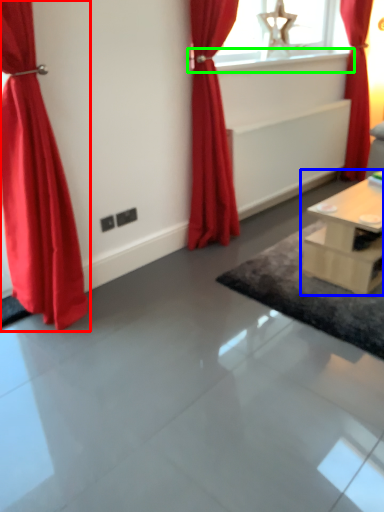
Question: Considering the real-world distances, which object is farthest from curtain (highlighted by a red box)? table (highlighted by a blue box) or window sill (highlighted by a green box)?

Choices:
 (A) table
 (B) window sill

Answer: (B)